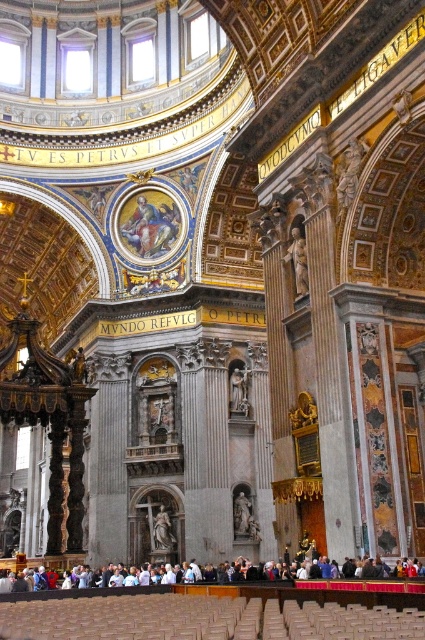
Does white marble statue at center have a larger size compared to smooth marble statue at center?

Yes.

Who is more distant from viewer, (399, 584) or (166, 516)?

The point (166, 516) is behind.

What are the coordinates of `white marble statue at center` in the screenshot? It's located at (365, 584).